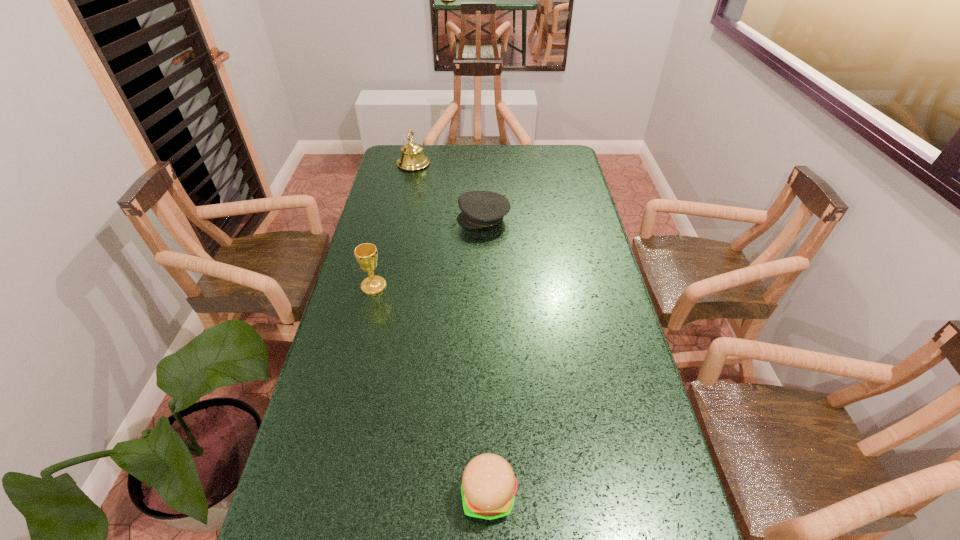
Find the location of a particular element. The image size is (960, 540). object that is at the far edge is located at coordinates (412, 157).

Locate an element on the screen. The height and width of the screenshot is (540, 960). bell that is at the left edge is located at coordinates (412, 157).

Where is `chalice that is at the left edge`? The width and height of the screenshot is (960, 540). chalice that is at the left edge is located at coordinates 366,254.

Where is `object that is positioned at the far left corner`? This screenshot has width=960, height=540. object that is positioned at the far left corner is located at coordinates (412, 157).

In the image, there is a desktop. At what (x,y) coordinates should I click in order to perform the action: click on vacant space at the far edge. Please return your answer as a coordinate pair (x, y). This screenshot has width=960, height=540. Looking at the image, I should click on (455, 170).

I want to click on free space at the right edge of the desktop, so click(546, 184).

Find the location of a particular element. This screenshot has width=960, height=540. free space between the bell and the hamburger is located at coordinates (451, 329).

Where is `vacant area that lies between the beret and the nearest object`? The height and width of the screenshot is (540, 960). vacant area that lies between the beret and the nearest object is located at coordinates (486, 357).

Locate an element on the screen. The height and width of the screenshot is (540, 960). empty location between the second nearest object and the hamburger is located at coordinates (431, 390).

Identify the location of vacant point located between the beret and the farthest object. (448, 191).